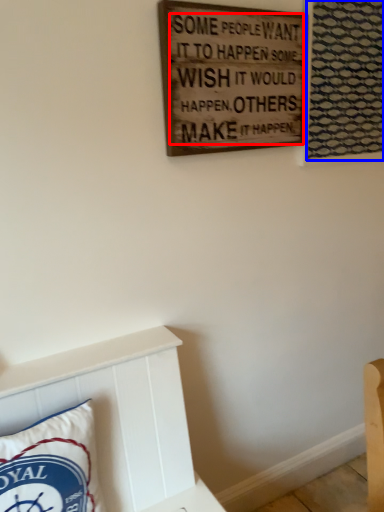
Question: Which of the following is the farthest to the observer, writing (highlighted by a red box) or tapestry (highlighted by a blue box)?

Choices:
 (A) writing
 (B) tapestry

Answer: (B)